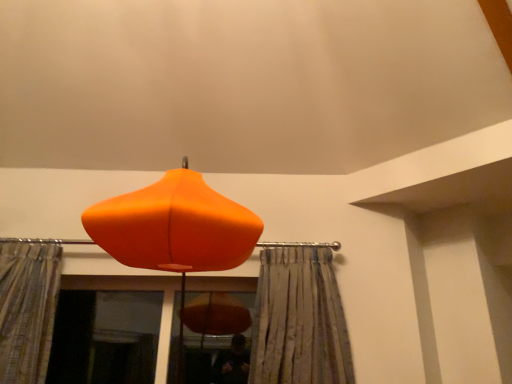
This screenshot has height=384, width=512. What do you see at coordinates (105, 337) in the screenshot?
I see `transparent glass screen door at lower left` at bounding box center [105, 337].

Describe the element at coordinates (298, 319) in the screenshot. The width and height of the screenshot is (512, 384). I see `silky gray curtain at center, which appears as the 2th curtain when viewed from the left` at that location.

The width and height of the screenshot is (512, 384). In order to click on transparent glass screen door at lower left in this screenshot , I will do `click(105, 337)`.

Between textured beige curtain at left, the second curtain positioned from the right, and orange matte lampshade at center, which one appears on the left side from the viewer's perspective?

Positioned to the left is textured beige curtain at left, the second curtain positioned from the right.

In the scene shown: Does textured beige curtain at left, which appears as the 1th curtain when viewed from the left, have a greater height compared to orange matte lampshade at center?

No, textured beige curtain at left, which appears as the 1th curtain when viewed from the left, is not taller than orange matte lampshade at center.

Can you confirm if textured beige curtain at left, which appears as the 1th curtain when viewed from the left, is thinner than orange matte lampshade at center?

Yes, textured beige curtain at left, which appears as the 1th curtain when viewed from the left, is thinner than orange matte lampshade at center.

From a real-world perspective, which is physically below, silky gray curtain at center, the first curtain when ordered from right to left, or textured beige curtain at left, the second curtain positioned from the right?

silky gray curtain at center, the first curtain when ordered from right to left.

In order to click on curtain on the left side of silky gray curtain at center, which appears as the 2th curtain when viewed from the left in this screenshot , I will do `click(27, 309)`.

Is silky gray curtain at center, which appears as the 2th curtain when viewed from the left, oriented towards textured beige curtain at left, the second curtain positioned from the right?

No, silky gray curtain at center, which appears as the 2th curtain when viewed from the left, is not aimed at textured beige curtain at left, the second curtain positioned from the right.

Can you tell me how much silky gray curtain at center, the first curtain when ordered from right to left, and textured beige curtain at left, the second curtain positioned from the right, differ in facing direction?

silky gray curtain at center, the first curtain when ordered from right to left, and textured beige curtain at left, the second curtain positioned from the right, are facing 2.98 degrees away from each other.

In the scene shown: Between orange matte lampshade at center and transparent glass screen door at lower left, which one has smaller size?

Smaller between the two is transparent glass screen door at lower left.

Does orange matte lampshade at center appear on the left side of transparent glass screen door at lower left?

Incorrect, orange matte lampshade at center is not on the left side of transparent glass screen door at lower left.

Looking at their sizes, would you say orange matte lampshade at center is wider or thinner than transparent glass screen door at lower left?

In the image, orange matte lampshade at center appears to be wider than transparent glass screen door at lower left.

Is orange matte lampshade at center facing away from transparent glass screen door at lower left?

No.

From a real-world perspective, who is located lower, textured beige curtain at left, which appears as the 1th curtain when viewed from the left, or transparent glass screen door at lower left?

transparent glass screen door at lower left.

From the image's perspective, is textured beige curtain at left, the second curtain positioned from the right, on top of transparent glass screen door at lower left?

Indeed, from the image's perspective, textured beige curtain at left, the second curtain positioned from the right, is shown above transparent glass screen door at lower left.

Does textured beige curtain at left, which appears as the 1th curtain when viewed from the left, have a smaller size compared to transparent glass screen door at lower left?

Actually, textured beige curtain at left, which appears as the 1th curtain when viewed from the left, might be larger than transparent glass screen door at lower left.

Is transparent glass screen door at lower left with orange matte lampshade at center?

No, transparent glass screen door at lower left is not next to orange matte lampshade at center.

Looking at this image, is transparent glass screen door at lower left to the left of orange matte lampshade at center from the viewer's perspective?

Indeed, transparent glass screen door at lower left is positioned on the left side of orange matte lampshade at center.

Is transparent glass screen door at lower left situated inside orange matte lampshade at center or outside?

transparent glass screen door at lower left lies outside orange matte lampshade at center.

Which is closer to the camera, (104, 370) or (146, 245)?

Point (146, 245)

Can you tell me how much silky gray curtain at center, which appears as the 2th curtain when viewed from the left, and orange matte lampshade at center differ in facing direction?

They differ by 1.89 degrees in their facing directions.

From a real-world perspective, is silky gray curtain at center, the first curtain when ordered from right to left, on top of orange matte lampshade at center?

No, from a real-world perspective, silky gray curtain at center, the first curtain when ordered from right to left, is not above orange matte lampshade at center.

Can you confirm if silky gray curtain at center, which appears as the 2th curtain when viewed from the left, is positioned to the left of orange matte lampshade at center?

No.

Is silky gray curtain at center, the first curtain when ordered from right to left, far from orange matte lampshade at center?

No, silky gray curtain at center, the first curtain when ordered from right to left, is not far from orange matte lampshade at center.

You are a GUI agent. You are given a task and a screenshot of the screen. Output one action in this format:
    pyautogui.click(x=<x>, y=<y>)
    Task: Click on the curtain in front of the silky gray curtain at center, which appears as the 2th curtain when viewed from the left
    Image resolution: width=512 pixels, height=384 pixels.
    Given the screenshot: What is the action you would take?
    pyautogui.click(x=27, y=309)

Considering the relative sizes of textured beige curtain at left, the second curtain positioned from the right, and silky gray curtain at center, which appears as the 2th curtain when viewed from the left, in the image provided, is textured beige curtain at left, the second curtain positioned from the right, thinner than silky gray curtain at center, which appears as the 2th curtain when viewed from the left,?

No, textured beige curtain at left, the second curtain positioned from the right, is not thinner than silky gray curtain at center, which appears as the 2th curtain when viewed from the left.

How much distance is there between textured beige curtain at left, which appears as the 1th curtain when viewed from the left, and silky gray curtain at center, the first curtain when ordered from right to left?

textured beige curtain at left, which appears as the 1th curtain when viewed from the left, is 1.26 meters away from silky gray curtain at center, the first curtain when ordered from right to left.

Is silky gray curtain at center, the first curtain when ordered from right to left, surrounded by textured beige curtain at left, which appears as the 1th curtain when viewed from the left?

No, silky gray curtain at center, the first curtain when ordered from right to left, is not inside textured beige curtain at left, which appears as the 1th curtain when viewed from the left.

Which curtain is the 1st one when counting from the back of the orange matte lampshade at center? Please provide its 2D coordinates.

[(27, 309)]

Locate an element on the screen. This screenshot has height=384, width=512. curtain above the silky gray curtain at center, the first curtain when ordered from right to left (from the image's perspective) is located at coordinates (27, 309).

When comparing their distances from silky gray curtain at center, the first curtain when ordered from right to left, does textured beige curtain at left, which appears as the 1th curtain when viewed from the left, or orange matte lampshade at center seem closer?

orange matte lampshade at center lies closer to silky gray curtain at center, the first curtain when ordered from right to left, than the other object.

From the image, which object appears to be farther from transparent glass screen door at lower left, orange matte lampshade at center or textured beige curtain at left, the second curtain positioned from the right?

orange matte lampshade at center is further to transparent glass screen door at lower left.

Looking at the image, which one is located closer to silky gray curtain at center, the first curtain when ordered from right to left, orange matte lampshade at center or textured beige curtain at left, the second curtain positioned from the right?

orange matte lampshade at center lies closer to silky gray curtain at center, the first curtain when ordered from right to left, than the other object.

Based on their spatial positions, is transparent glass screen door at lower left or silky gray curtain at center, which appears as the 2th curtain when viewed from the left, further from orange matte lampshade at center?

Among the two, transparent glass screen door at lower left is located further to orange matte lampshade at center.

When comparing their distances from orange matte lampshade at center, does transparent glass screen door at lower left or textured beige curtain at left, which appears as the 1th curtain when viewed from the left, seem closer?

textured beige curtain at left, which appears as the 1th curtain when viewed from the left, is closer to orange matte lampshade at center.

Looking at the image, which one is located further to textured beige curtain at left, the second curtain positioned from the right, transparent glass screen door at lower left or silky gray curtain at center, the first curtain when ordered from right to left?

silky gray curtain at center, the first curtain when ordered from right to left, is positioned further to the anchor textured beige curtain at left, the second curtain positioned from the right.

Based on their spatial positions, is orange matte lampshade at center or transparent glass screen door at lower left closer to textured beige curtain at left, which appears as the 1th curtain when viewed from the left?

orange matte lampshade at center is positioned closer to the anchor textured beige curtain at left, which appears as the 1th curtain when viewed from the left.

Looking at the image, which one is located closer to silky gray curtain at center, which appears as the 2th curtain when viewed from the left, orange matte lampshade at center or transparent glass screen door at lower left?

The object closer to silky gray curtain at center, which appears as the 2th curtain when viewed from the left, is orange matte lampshade at center.

The width and height of the screenshot is (512, 384). I want to click on screen door between textured beige curtain at left, which appears as the 1th curtain when viewed from the left, and silky gray curtain at center, the first curtain when ordered from right to left, so click(105, 337).

Identify the location of lamp between textured beige curtain at left, which appears as the 1th curtain when viewed from the left, and silky gray curtain at center, the first curtain when ordered from right to left. (174, 226).